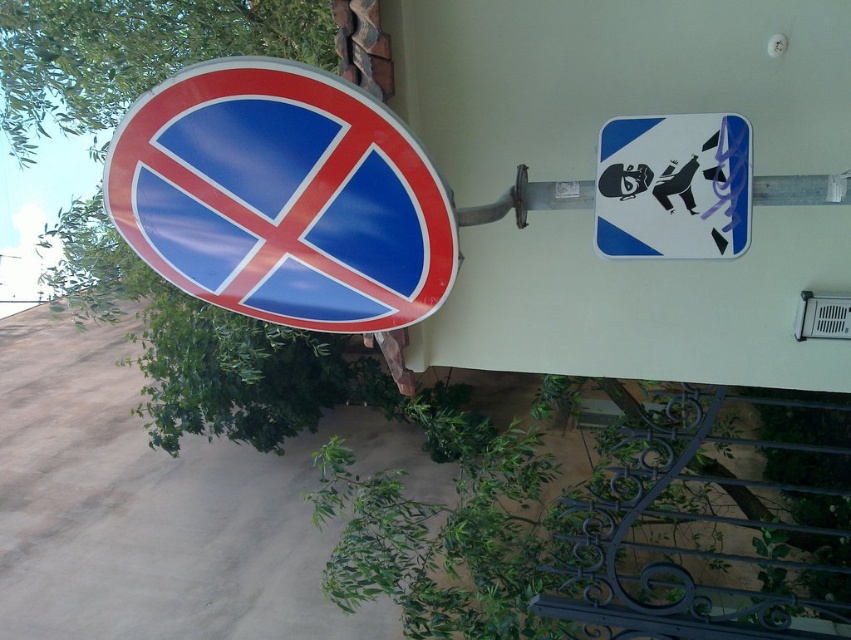
You are a delivery driver who needs to park your vehicle near the shiny plastic sign at left. Based on the scene, can you determine if parking is allowed here?

The shiny plastic sign at left has a red border and a blue background with a red diagonal cross, indicating that parking is prohibited. Therefore, parking here is not allowed.

You are standing 5 feet away from a shiny plastic sign at left. You want to touch the sign. Is it possible to reach it without moving your feet?

The distance between you and the shiny plastic sign at left is 5.02 feet, which is slightly more than 5 feet. Therefore, you cannot reach the sign without moving your feet.

You are standing in front of two traffic signs on a pole. You see a point at coordinates point (283, 196). Which object is this point located on? The objects are the shiny plastic sign at left and the rectangular sign to its right.

The point (283, 196) is located on the shiny plastic sign at left.